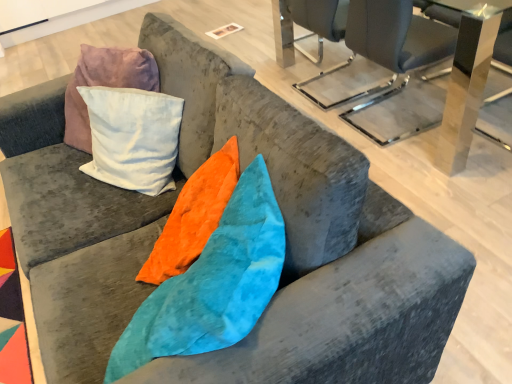
Question: Can you confirm if transparent acrylic table at upper center, which is counted as the 2th table, starting from the back, is shorter than metallic glass table at upper right, placed as the 2th table when sorted from front to back?

Choices:
 (A) yes
 (B) no

Answer: (B)

Question: Is transparent acrylic table at upper center, which is counted as the 2th table, starting from the back, not within metallic glass table at upper right, placed as the 2th table when sorted from front to back?

Choices:
 (A) no
 (B) yes

Answer: (B)

Question: From the image's perspective, is transparent acrylic table at upper center, acting as the first table starting from the front, under metallic glass table at upper right, placed as the 2th table when sorted from front to back?

Choices:
 (A) yes
 (B) no

Answer: (B)

Question: Are transparent acrylic table at upper center, which is counted as the 2th table, starting from the back, and metallic glass table at upper right, the first table in the back-to-front sequence, located far from each other?

Choices:
 (A) no
 (B) yes

Answer: (A)

Question: Is transparent acrylic table at upper center, which is counted as the 2th table, starting from the back, placed right next to metallic glass table at upper right, the first table in the back-to-front sequence?

Choices:
 (A) yes
 (B) no

Answer: (A)

Question: Can you confirm if transparent acrylic table at upper center, which is counted as the 2th table, starting from the back, is smaller than metallic glass table at upper right, the first table in the back-to-front sequence?

Choices:
 (A) no
 (B) yes

Answer: (A)

Question: Does metallic gray chair at upper right have a greater height compared to transparent acrylic table at upper center, which is counted as the 2th table, starting from the back?

Choices:
 (A) yes
 (B) no

Answer: (B)

Question: Is transparent acrylic table at upper center, acting as the first table starting from the front, a part of metallic gray chair at upper right?

Choices:
 (A) yes
 (B) no

Answer: (B)

Question: Is metallic gray chair at upper right far from transparent acrylic table at upper center, acting as the first table starting from the front?

Choices:
 (A) yes
 (B) no

Answer: (B)

Question: Is metallic gray chair at upper right outside of transparent acrylic table at upper center, which is counted as the 2th table, starting from the back?

Choices:
 (A) no
 (B) yes

Answer: (A)

Question: Is metallic gray chair at upper right smaller than transparent acrylic table at upper center, which is counted as the 2th table, starting from the back?

Choices:
 (A) yes
 (B) no

Answer: (A)

Question: From a real-world perspective, is metallic gray chair at upper right positioned over transparent acrylic table at upper center, acting as the first table starting from the front, based on gravity?

Choices:
 (A) no
 (B) yes

Answer: (A)

Question: Is transparent acrylic table at upper center, which is counted as the 2th table, starting from the back, looking in the opposite direction of metallic gray chair at upper right?

Choices:
 (A) yes
 (B) no

Answer: (A)